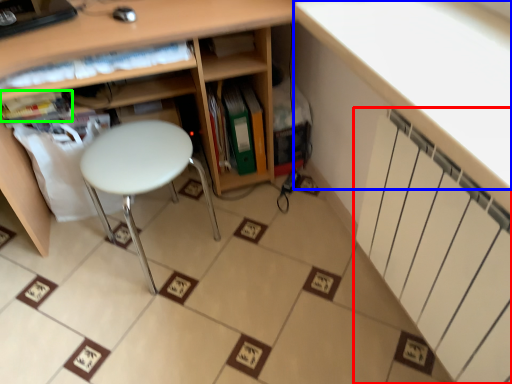
Question: Which object is positioned farthest from radiator (highlighted by a red box)? Select from counter top (highlighted by a blue box) and book (highlighted by a green box).

Choices:
 (A) counter top
 (B) book

Answer: (B)